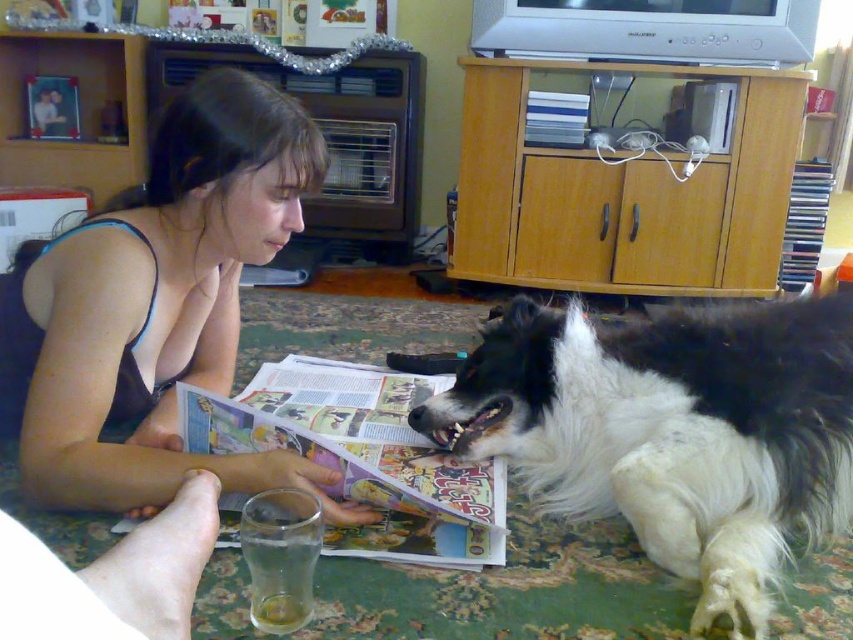
Question: Does printed paper magazine at lower center appear over hardcover book at upper center?

Choices:
 (A) yes
 (B) no

Answer: (B)

Question: Which object is farther from the camera taking this photo?

Choices:
 (A) printed paper magazine at lower center
 (B) hardcover book at upper center

Answer: (B)

Question: Is black and white fur at lower right further to camera compared to matte black tank top at upper left?

Choices:
 (A) no
 (B) yes

Answer: (A)

Question: Which point is farther from the camera taking this photo?

Choices:
 (A) (833, 442)
 (B) (561, 122)
 (C) (177, 225)
 (D) (444, 561)

Answer: (B)

Question: Which object is farther from the camera taking this photo?

Choices:
 (A) hardcover book at upper center
 (B) matte black tank top at upper left
 (C) black and white fur at lower right

Answer: (A)

Question: Where is matte black tank top at upper left located in relation to printed paper magazine at lower center in the image?

Choices:
 (A) above
 (B) below

Answer: (A)